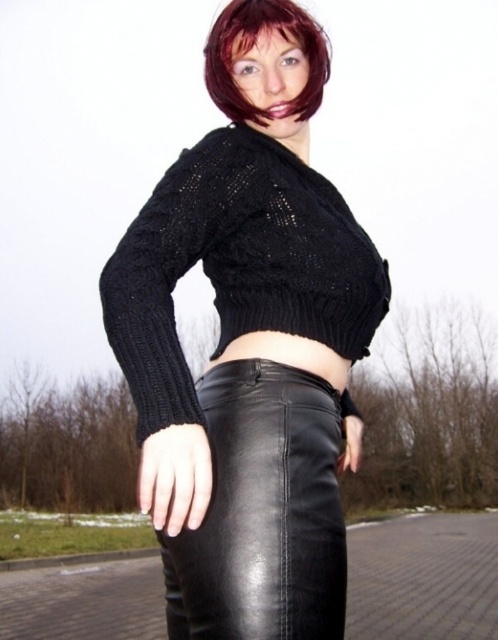
Question: Does black leather skirt at lower center appear on the left side of dark brown hair at upper center?

Choices:
 (A) yes
 (B) no

Answer: (B)

Question: Estimate the real-world distances between objects in this image. Which object is closer to the black leather skirt at lower center?

Choices:
 (A) black leather skirt at center
 (B) dark red hair at upper center

Answer: (A)

Question: Is black leather skirt at center positioned before dark brown hair at upper center?

Choices:
 (A) yes
 (B) no

Answer: (A)

Question: Which of the following is the closest to the observer?

Choices:
 (A) black leather skirt at lower center
 (B) black leather skirt at center

Answer: (B)

Question: Does black leather skirt at center come in front of black leather skirt at lower center?

Choices:
 (A) yes
 (B) no

Answer: (A)

Question: Among these points, which one is nearest to the camera?

Choices:
 (A) (261, 26)
 (B) (246, 28)

Answer: (B)